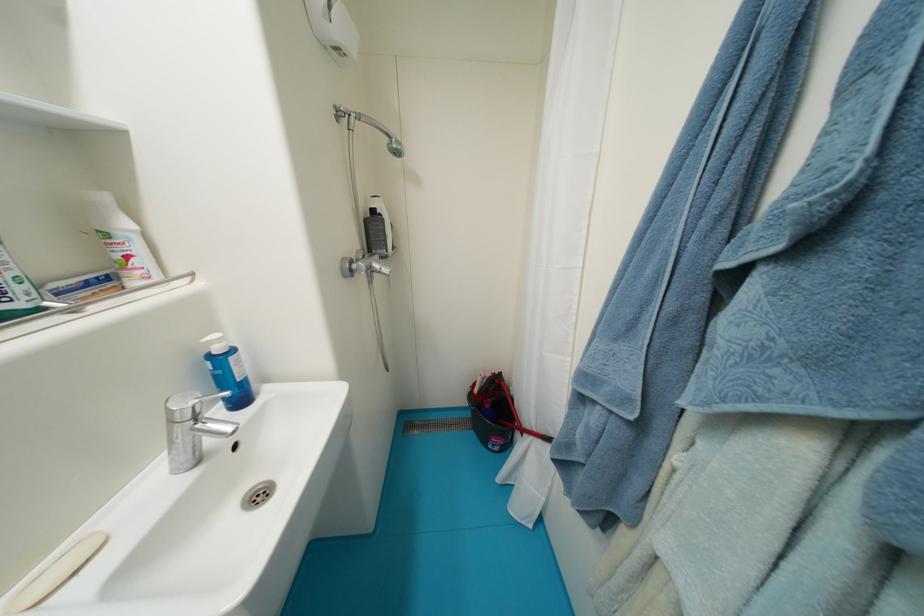
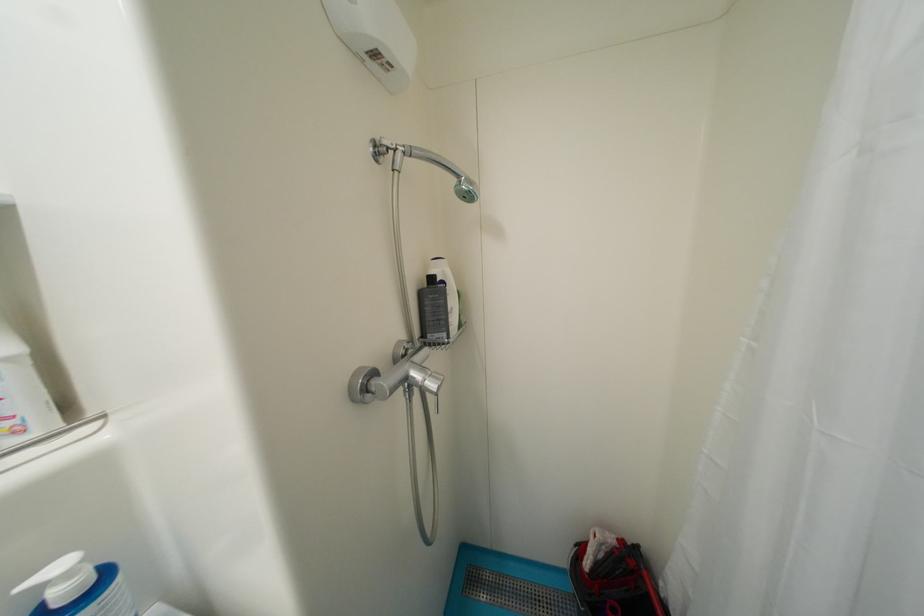
Question: The images are taken continuously from a first-person perspective. In which direction is your viewpoint rotating?

Choices:
 (A) Left
 (B) Right
 (C) Up
 (D) Down

Answer: (A)